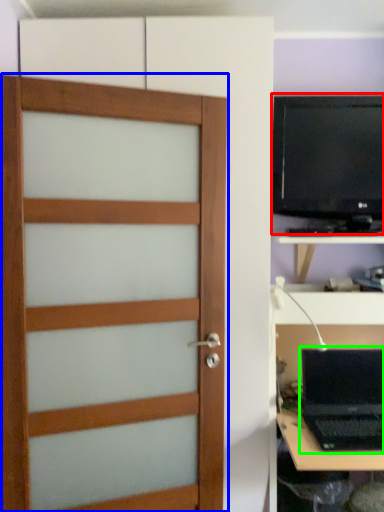
Question: Which is farther away from computer monitor (highlighted by a red box)? door (highlighted by a blue box) or laptop (highlighted by a green box)?

Choices:
 (A) door
 (B) laptop

Answer: (B)